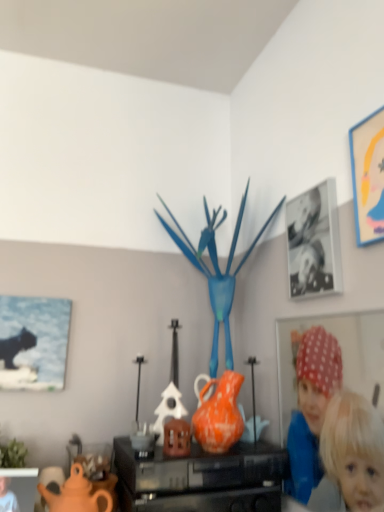
What do you see at coordinates (218, 413) in the screenshot?
I see `orange matte vase at center` at bounding box center [218, 413].

At what (x,y) coordinates should I click in order to perform the action: click on matte black cat at left, arranged as the 3th picture frame when viewed from the top. Please return your answer as a coordinate pair (x, y). This screenshot has height=512, width=384. Looking at the image, I should click on (33, 342).

The width and height of the screenshot is (384, 512). What do you see at coordinates (76, 495) in the screenshot?
I see `matte orange teapot at lower left` at bounding box center [76, 495].

Locate an element on the screen. This screenshot has height=512, width=384. matte black picture frame at lower left, which is the 1th picture frame from bottom to top is located at coordinates (17, 489).

Is matte black picture frame at lower left, which appears as the third picture frame when viewed from the right, located outside matte orange vase at center?

Indeed, matte black picture frame at lower left, which appears as the third picture frame when viewed from the right, is completely outside matte orange vase at center.

Which of these two, matte black picture frame at lower left, which is the 1th picture frame from bottom to top, or matte orange vase at center, is smaller?

matte black picture frame at lower left, which is the 1th picture frame from bottom to top, is smaller.

Is matte black picture frame at lower left, which appears as the third picture frame when viewed from the right, turned away from matte orange vase at center?

No, matte black picture frame at lower left, which appears as the third picture frame when viewed from the right,'s orientation is not away from matte orange vase at center.

Is matte black picture frame at lower left, which is the 1th picture frame from bottom to top, far away from matte orange vase at center?

No, matte black picture frame at lower left, which is the 1th picture frame from bottom to top, is not far away from matte orange vase at center.

The width and height of the screenshot is (384, 512). Find the location of `picture frame directly beneath the matte orange teapot at lower left (from a real-world perspective)`. picture frame directly beneath the matte orange teapot at lower left (from a real-world perspective) is located at coordinates (17, 489).

Considering the sizes of objects matte orange teapot at lower left and matte black picture frame at lower left, which is the 1th picture frame from bottom to top, in the image provided, who is taller, matte orange teapot at lower left or matte black picture frame at lower left, which is the 1th picture frame from bottom to top,?

matte orange teapot at lower left is taller.

Is matte orange teapot at lower left bigger than matte black picture frame at lower left, which appears as the third picture frame when viewed from the right?

Indeed, matte orange teapot at lower left has a larger size compared to matte black picture frame at lower left, which appears as the third picture frame when viewed from the right.

Is matte black picture frame at lower left, which appears as the third picture frame when viewed from the right, completely or partially inside matte orange teapot at lower left?

Actually, matte black picture frame at lower left, which appears as the third picture frame when viewed from the right, is outside matte orange teapot at lower left.

Is black glossy photo frame at upper right, positioned as the 2th picture frame in right-to-left order, inside or outside of orange matte vase at center?

black glossy photo frame at upper right, positioned as the 2th picture frame in right-to-left order, is outside orange matte vase at center.

From the image's perspective, relative to orange matte vase at center, is black glossy photo frame at upper right, which ranks as the third picture frame in bottom-to-top order, above or below?

black glossy photo frame at upper right, which ranks as the third picture frame in bottom-to-top order, is above orange matte vase at center.

How distant is black glossy photo frame at upper right, positioned as the 2th picture frame in right-to-left order, from orange matte vase at center?

black glossy photo frame at upper right, positioned as the 2th picture frame in right-to-left order, and orange matte vase at center are 17.60 inches apart.

Could you tell me if black glossy photo frame at upper right, positioned as the 2th picture frame in right-to-left order, is turned towards orange matte vase at center?

No, black glossy photo frame at upper right, positioned as the 2th picture frame in right-to-left order, does not turn towards orange matte vase at center.

In the scene shown: Does black glossy photo frame at upper right, arranged as the 3th picture frame when viewed from the left, have a larger size compared to matte black picture frame at lower left, which is the 1th picture frame from bottom to top?

No.

Could you measure the distance between black glossy photo frame at upper right, positioned as the 2th picture frame in right-to-left order, and matte black picture frame at lower left, which appears as the third picture frame when viewed from the right?

The distance of black glossy photo frame at upper right, positioned as the 2th picture frame in right-to-left order, from matte black picture frame at lower left, which appears as the third picture frame when viewed from the right, is 38.07 inches.

Is matte black picture frame at lower left, which appears as the third picture frame when viewed from the right, inside black glossy photo frame at upper right, arranged as the 3th picture frame when viewed from the left?

That's incorrect, matte black picture frame at lower left, which appears as the third picture frame when viewed from the right, is not inside black glossy photo frame at upper right, arranged as the 3th picture frame when viewed from the left.

From the image's perspective, which one is positioned higher, black glossy photo frame at upper right, arranged as the 2th picture frame when viewed from the top, or matte black picture frame at lower left, which is the 4th picture frame in top-to-bottom order?

black glossy photo frame at upper right, arranged as the 2th picture frame when viewed from the top, appears higher in the image.

Which object is further away from the camera taking this photo, matte orange vase at center or matte black cat at left, the fourth picture frame in the right-to-left sequence?

matte black cat at left, the fourth picture frame in the right-to-left sequence, is further from the camera.

Between matte orange vase at center and matte black cat at left, the 2th picture frame from the bottom, which one has less height?

matte orange vase at center.

Based on the photo, in terms of width, does matte orange vase at center look wider or thinner when compared to matte black cat at left, the fourth picture frame in the right-to-left sequence?

Considering their sizes, matte orange vase at center looks broader than matte black cat at left, the fourth picture frame in the right-to-left sequence.

Is matte orange vase at center positioned far away from matte black cat at left, the 2th picture frame from the bottom?

No, matte orange vase at center is not far from matte black cat at left, the 2th picture frame from the bottom.

Would you say matte yellow picture frame at upper right, marked as the 4th picture frame in a left-to-right arrangement, is outside orange matte vase at center?

matte yellow picture frame at upper right, marked as the 4th picture frame in a left-to-right arrangement, lies outside orange matte vase at center's area.

Consider the image. Does matte yellow picture frame at upper right, the first picture frame when ordered from top to bottom, turn towards orange matte vase at center?

No, matte yellow picture frame at upper right, the first picture frame when ordered from top to bottom, is not turned towards orange matte vase at center.

Is matte yellow picture frame at upper right, which ranks as the 1th picture frame in right-to-left order, further to the viewer compared to orange matte vase at center?

No, matte yellow picture frame at upper right, which ranks as the 1th picture frame in right-to-left order, is in front of orange matte vase at center.

Between matte yellow picture frame at upper right, the first picture frame when ordered from top to bottom, and orange matte vase at center, which one appears on the right side from the viewer's perspective?

matte yellow picture frame at upper right, the first picture frame when ordered from top to bottom.

Which of these two, matte black cat at left, the 2th picture frame from the bottom, or matte orange teapot at lower left, is wider?

matte orange teapot at lower left.

Which is behind, matte black cat at left, arranged as the 3th picture frame when viewed from the top, or matte orange teapot at lower left?

matte black cat at left, arranged as the 3th picture frame when viewed from the top, is more distant.

Consider the image. Is matte black cat at left, arranged as the 3th picture frame when viewed from the top, positioned far away from matte orange teapot at lower left?

They are positioned close to each other.

Is matte black cat at left, the fourth picture frame in the right-to-left sequence, not inside matte orange teapot at lower left?

Yes, matte black cat at left, the fourth picture frame in the right-to-left sequence, is outside of matte orange teapot at lower left.

This screenshot has height=512, width=384. I want to click on the 1st picture frame in front when counting from the matte orange vase at center, so click(17, 489).

I want to click on teapot behind the matte black picture frame at lower left, the second picture frame viewed from the left, so pyautogui.click(x=76, y=495).

Which object lies nearer to the anchor point matte orange vase at center, orange matte vase at center or matte black picture frame at lower left, which is the 1th picture frame from bottom to top?

Based on the image, orange matte vase at center appears to be nearer to matte orange vase at center.

When comparing their distances from black glossy photo frame at upper right, arranged as the 2th picture frame when viewed from the top, does orange matte vase at center or matte yellow picture frame at upper right, the first picture frame when ordered from top to bottom, seem further?

Among the two, orange matte vase at center is located further to black glossy photo frame at upper right, arranged as the 2th picture frame when viewed from the top.

From the image, which object appears to be nearer to black glossy photo frame at upper right, which ranks as the third picture frame in bottom-to-top order, matte orange vase at center or matte orange teapot at lower left?

matte orange vase at center is positioned closer to the anchor black glossy photo frame at upper right, which ranks as the third picture frame in bottom-to-top order.

Looking at the image, which one is located closer to matte orange vase at center, matte black picture frame at lower left, the second picture frame viewed from the left, or matte orange teapot at lower left?

Based on the image, matte orange teapot at lower left appears to be nearer to matte orange vase at center.

From the image, which object appears to be nearer to matte black picture frame at lower left, which appears as the third picture frame when viewed from the right, orange matte vase at center or matte orange teapot at lower left?

Based on the image, matte orange teapot at lower left appears to be nearer to matte black picture frame at lower left, which appears as the third picture frame when viewed from the right.

Which object lies further to the anchor point matte black cat at left, arranged as the 3th picture frame when viewed from the top, matte yellow picture frame at upper right, marked as the 4th picture frame in a left-to-right arrangement, or matte black picture frame at lower left, the second picture frame viewed from the left?

matte yellow picture frame at upper right, marked as the 4th picture frame in a left-to-right arrangement, is further to matte black cat at left, arranged as the 3th picture frame when viewed from the top.

From the picture: Which object lies further to the anchor point matte yellow picture frame at upper right, marked as the 4th picture frame in a left-to-right arrangement, matte black cat at left, arranged as the 3th picture frame when viewed from the top, or matte orange vase at center?

matte black cat at left, arranged as the 3th picture frame when viewed from the top.

Consider the image. Estimate the real-world distances between objects in this image. Which object is further from matte orange teapot at lower left, matte black cat at left, the fourth picture frame in the right-to-left sequence, or orange matte vase at center?

matte black cat at left, the fourth picture frame in the right-to-left sequence, is further to matte orange teapot at lower left.

Identify the location of teapot between matte black cat at left, the 2th picture frame from the bottom, and black glossy photo frame at upper right, arranged as the 2th picture frame when viewed from the top, in the horizontal direction. (76, 495).

At what (x,y) coordinates should I click in order to perform the action: click on vase between matte black picture frame at lower left, which is the 4th picture frame in top-to-bottom order, and black glossy photo frame at upper right, which ranks as the third picture frame in bottom-to-top order, in the horizontal direction. Please return your answer as a coordinate pair (x, y). Image resolution: width=384 pixels, height=512 pixels. Looking at the image, I should click on (218, 413).

Locate an element on the screen. This screenshot has height=512, width=384. picture frame situated between matte black cat at left, arranged as the 3th picture frame when viewed from the top, and orange matte vase at center from left to right is located at coordinates (17, 489).

Locate an element on the screen. Image resolution: width=384 pixels, height=512 pixels. picture frame between matte black cat at left, the first picture frame positioned from the left, and black glossy photo frame at upper right, positioned as the 2th picture frame in right-to-left order, from left to right is located at coordinates (17, 489).